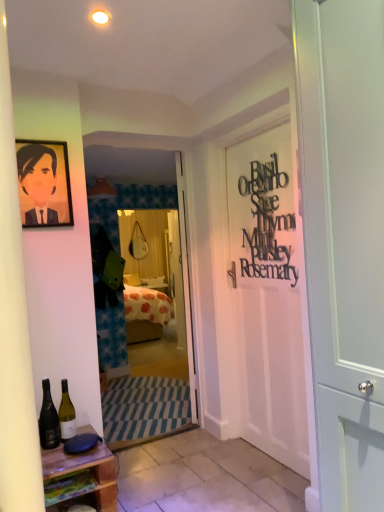
Identify the location of unoccupied area behind clear plastic screen door at center. (155, 426).